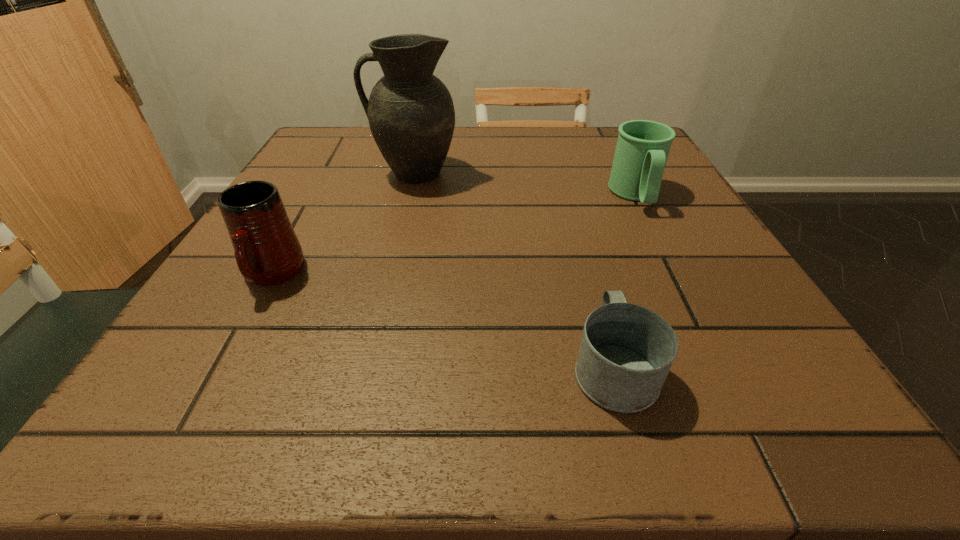
Where is `unoccupied position between the third object from right to left and the second farthest mug`? The image size is (960, 540). unoccupied position between the third object from right to left and the second farthest mug is located at coordinates (343, 224).

Locate an element on the screen. free space between the third farthest object and the farthest mug is located at coordinates (x=454, y=235).

The height and width of the screenshot is (540, 960). What are the coordinates of `free spot between the second mug from right to left and the second nearest mug` in the screenshot? It's located at (443, 321).

Find the location of a particular element. empty location between the second nearest mug and the nearest mug is located at coordinates (443, 321).

Choose which object is the third nearest neighbor to the tallest object. Please provide its 2D coordinates. Your answer should be formatted as a tuple, i.e. [(x, y)], where the tuple contains the x and y coordinates of a point satisfying the conditions above.

[(626, 352)]

The height and width of the screenshot is (540, 960). In order to click on the second closest object to the third farthest object in this screenshot , I will do `click(626, 352)`.

Locate which mug ranks second in proximity to the leftmost object. Please provide its 2D coordinates. Your answer should be formatted as a tuple, i.e. [(x, y)], where the tuple contains the x and y coordinates of a point satisfying the conditions above.

[(643, 146)]

Where is `mug that can be found as the closest to the leftmost object`? mug that can be found as the closest to the leftmost object is located at coordinates (626, 352).

The width and height of the screenshot is (960, 540). Find the location of `vacant space that satisfies the following two spatial constraints: 1. on the side of the second object from left to right with the handle; 2. on the side of the third farthest object with the handle`. vacant space that satisfies the following two spatial constraints: 1. on the side of the second object from left to right with the handle; 2. on the side of the third farthest object with the handle is located at coordinates (390, 275).

Find the location of a particular element. This screenshot has height=540, width=960. blank space that satisfies the following two spatial constraints: 1. on the side of the shortest object with the handle; 2. on the side of the tallest object with the handle is located at coordinates (559, 173).